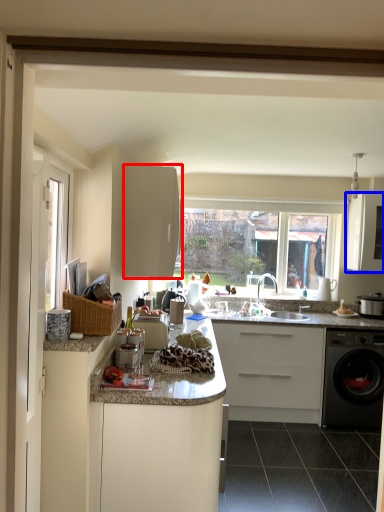
Question: Which of the following is the farthest to the observer, cabinetry (highlighted by a red box) or cabinetry (highlighted by a blue box)?

Choices:
 (A) cabinetry
 (B) cabinetry

Answer: (B)